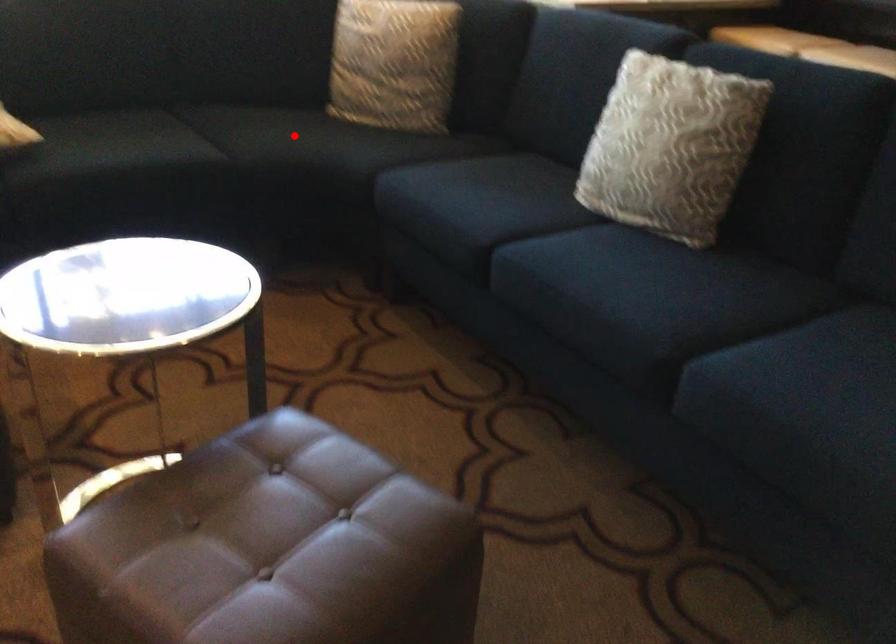
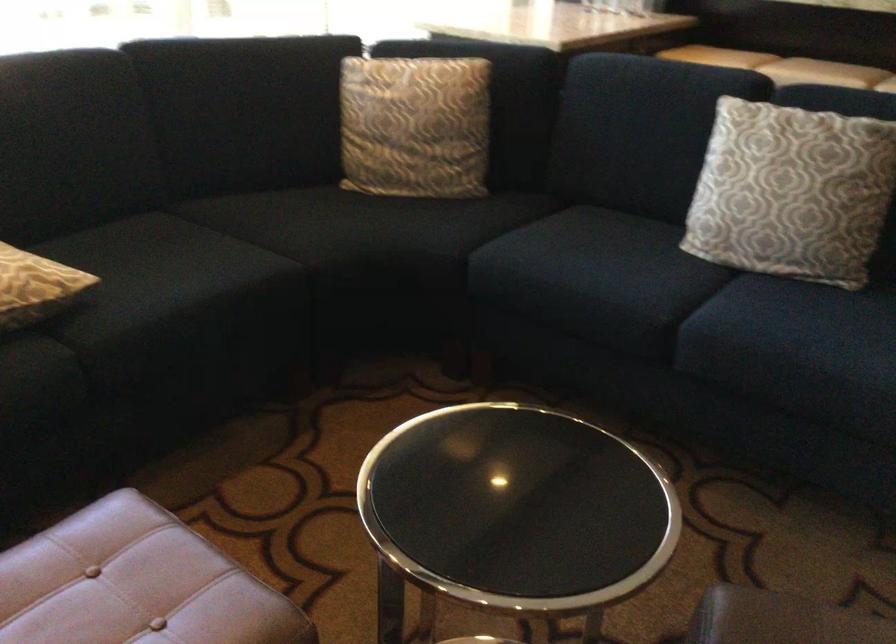
Question: I am providing you with two images of the same scene from different viewpoints. In image1, a red point is highlighted. Considering the same 3D point in image2, which of the following is correct?

Choices:
 (A) It is closer
 (B) It is farther

Answer: (A)